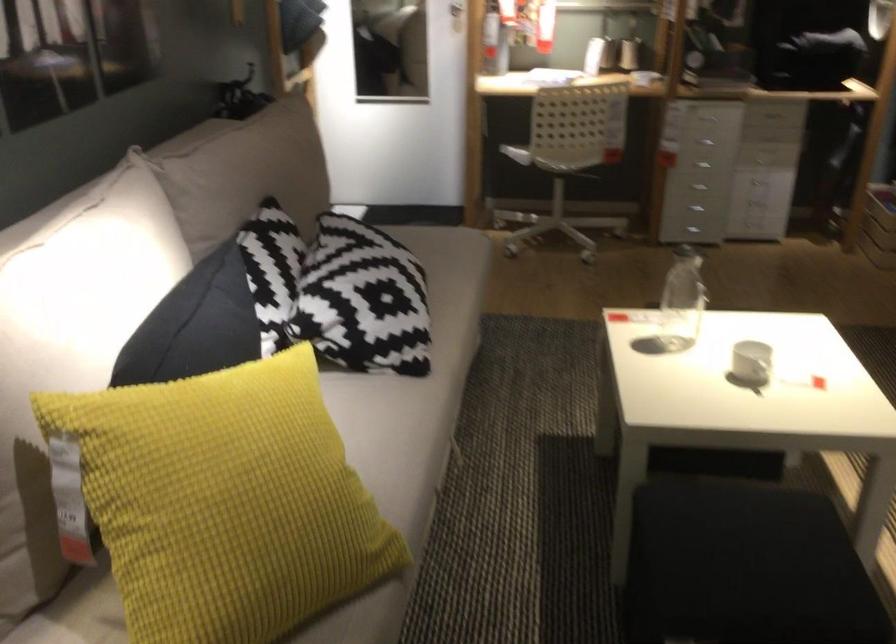
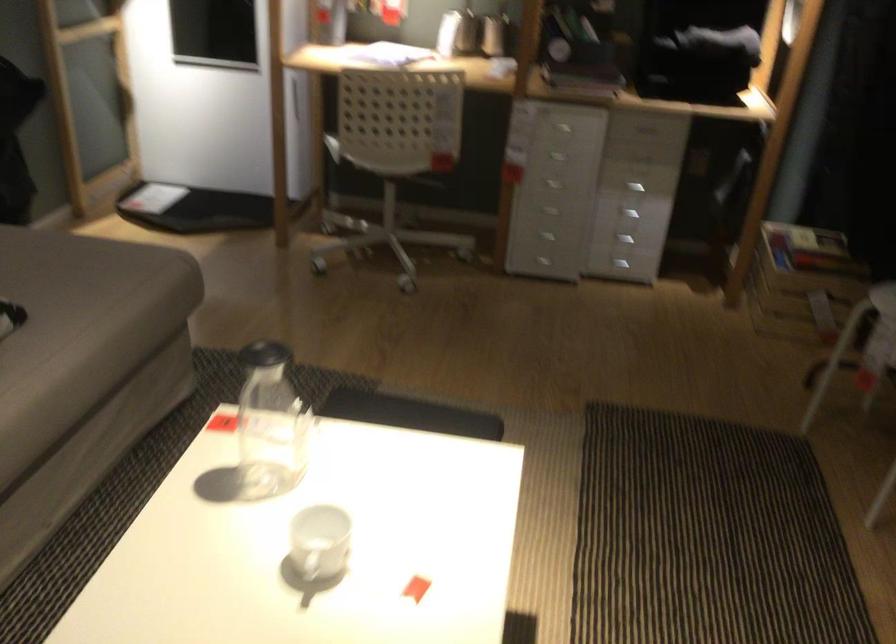
Question: Based on the continuous images, in which direction is the camera rotating? Reply with the corresponding letter.

Choices:
 (A) Left
 (B) Right
 (C) Up
 (D) Down

Answer: (D)